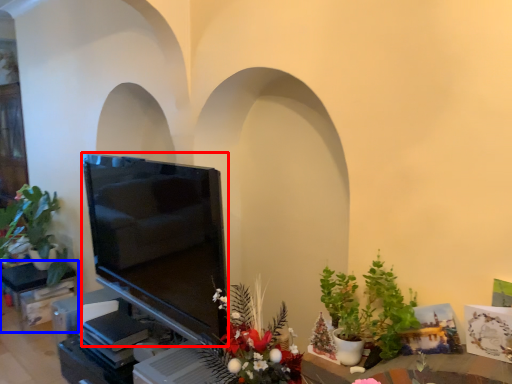
Question: Among these objects, which one is farthest to the camera, television (highlighted by a red box) or furniture (highlighted by a blue box)?

Choices:
 (A) television
 (B) furniture

Answer: (B)